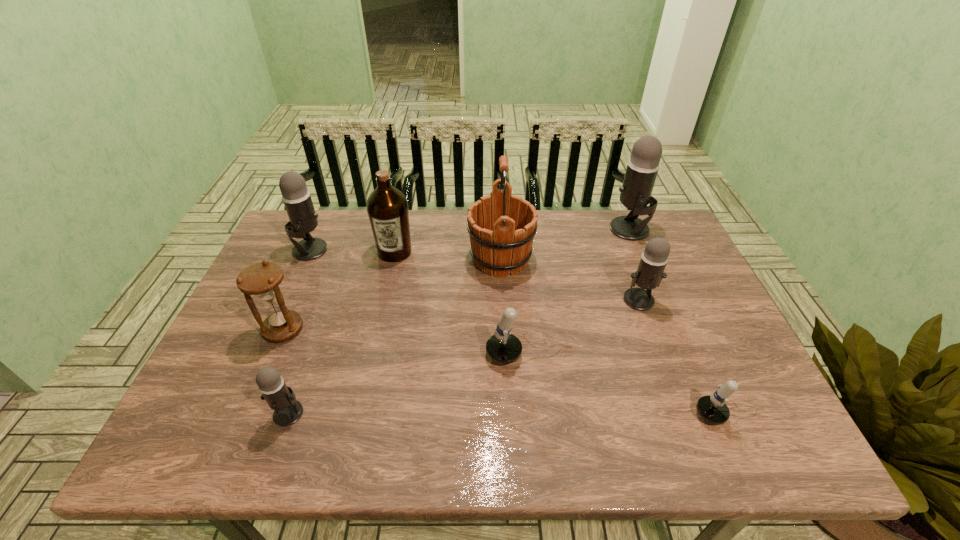
Identify which gray microphone is the third closest to the wood wine bucket. Please provide its 2D coordinates. Your answer should be formatted as a tuple, i.e. [(x, y)], where the tuple contains the x and y coordinates of a point satisfying the conditions above.

[(296, 197)]

Choose which gray microphone is the nearest neighbor to the leftmost gray microphone. Please provide its 2D coordinates. Your answer should be formatted as a tuple, i.e. [(x, y)], where the tuple contains the x and y coordinates of a point satisfying the conditions above.

[(279, 397)]

The image size is (960, 540). Identify the location of free space that satisfies the following two spatial constraints: 1. on the front side of the fifth farthest object; 2. on the right side of the shortest object. (682, 415).

The width and height of the screenshot is (960, 540). In order to click on blank area in the image that satisfies the following two spatial constraints: 1. on the front side of the hourglass; 2. on the left side of the second gray microphone from left to right in this screenshot , I will do `click(248, 413)`.

I want to click on vacant space that satisfies the following two spatial constraints: 1. on the label of the fifth nearest object; 2. on the right side of the olive oil, so click(385, 300).